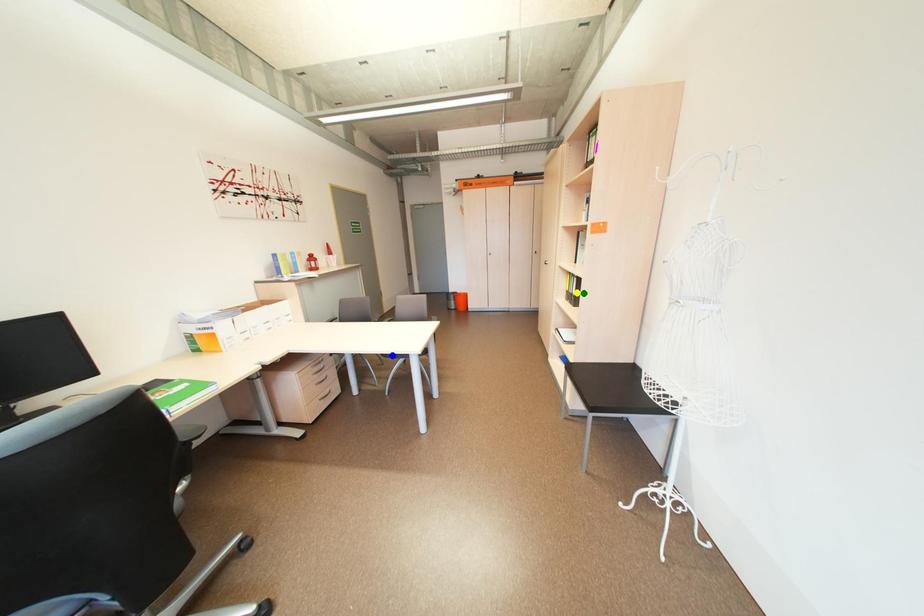
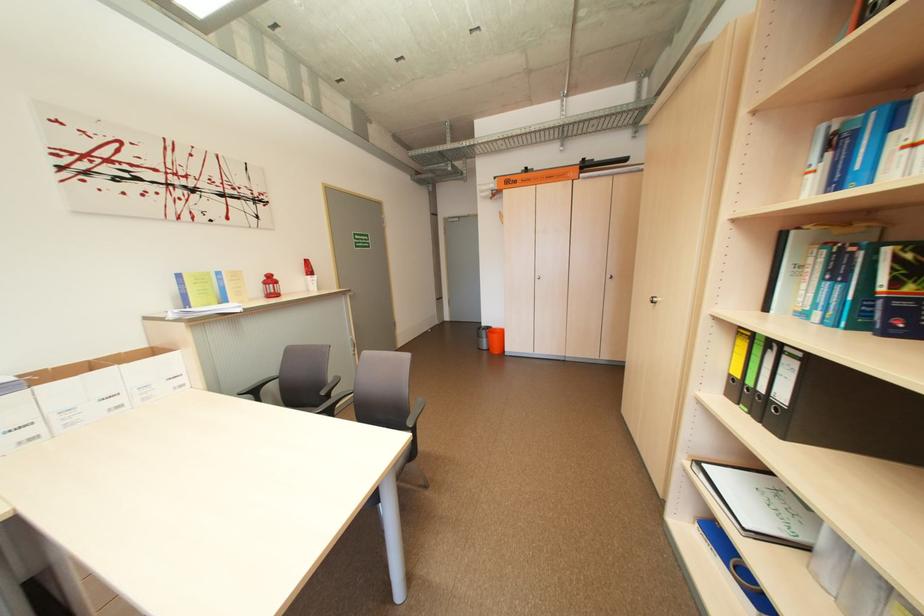
I am providing you with two images of the same scene from different viewpoints. Three points are marked in image1. Which point corresponds to a part or object that is occluded in image2?In image1, three points are marked. Which of them correspond to a part or object that is occluded in image2?Among the three points shown in image1, which one corresponds to a part or object that is no longer visible due to occlusion in image2?

Invisible in image2: blue point.